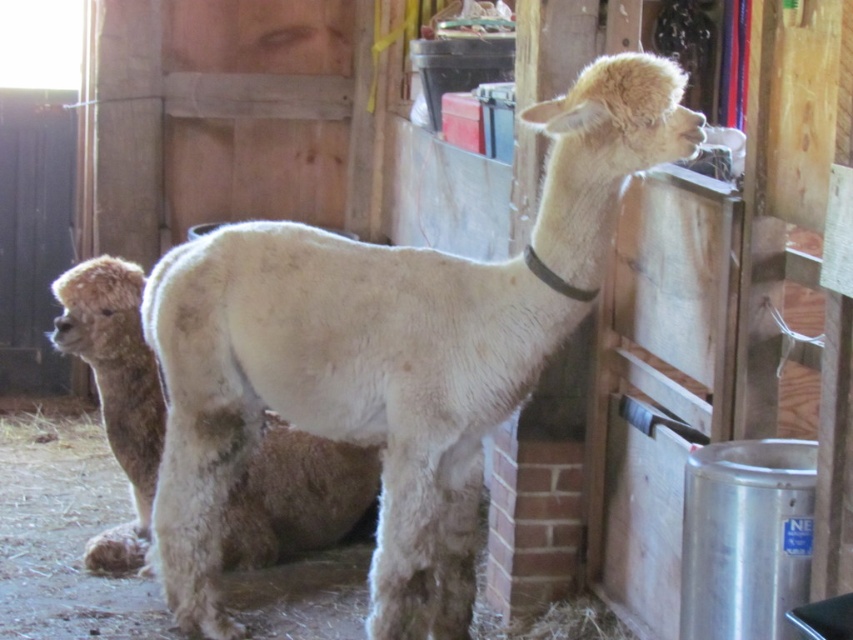
You are standing in the barn and want to place a new hay bale at one of two specific points. The first point is at coordinates point (172,586) and the second is at point (312,480). Which point is closer to you?

Answer: Point (172,586) is closer to the camera than point (312,480), so the hay bale placed there would be nearer to you.

In the barn scene, there are two alpacas described as the white woolen alpaca at center and the fuzzy white alpaca at center. From the observer standing in front of the barn, which alpaca is positioned more to the right?

The white woolen alpaca at center is positioned more to the right compared to the fuzzy white alpaca at center.